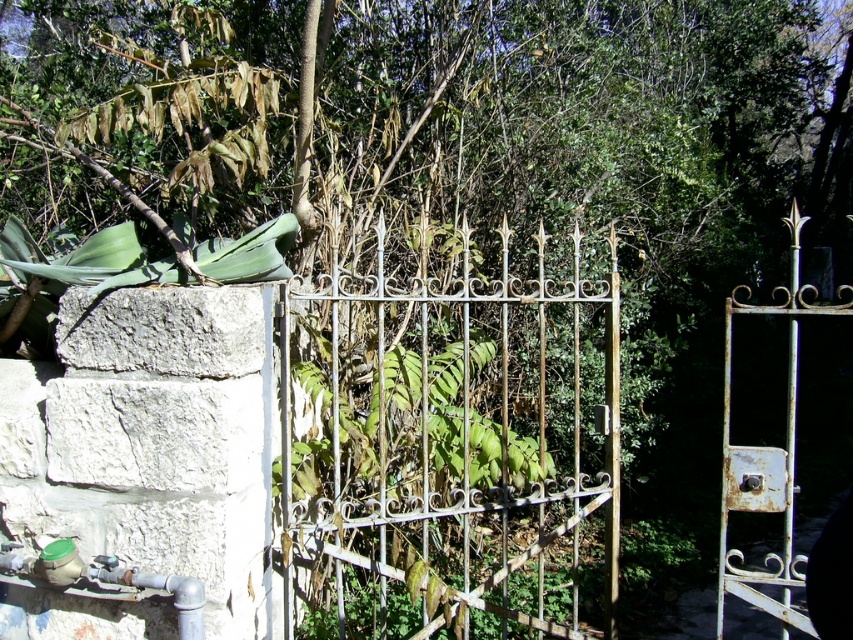
Question: Which of the following is the farthest from the observer?

Choices:
 (A) (735, 292)
 (B) (300, 452)

Answer: (A)

Question: Which point is closer to the camera?

Choices:
 (A) rusty metal gate at right
 (B) rusty metal gate at center

Answer: (B)

Question: Which of the following is the farthest from the observer?

Choices:
 (A) (810, 612)
 (B) (401, 454)

Answer: (B)

Question: Does rusty metal gate at center appear under rusty metal gate at right?

Choices:
 (A) no
 (B) yes

Answer: (A)

Question: Can you confirm if rusty metal gate at center is positioned above rusty metal gate at right?

Choices:
 (A) no
 (B) yes

Answer: (B)

Question: Does rusty metal gate at center have a lesser width compared to rusty metal gate at right?

Choices:
 (A) yes
 (B) no

Answer: (B)